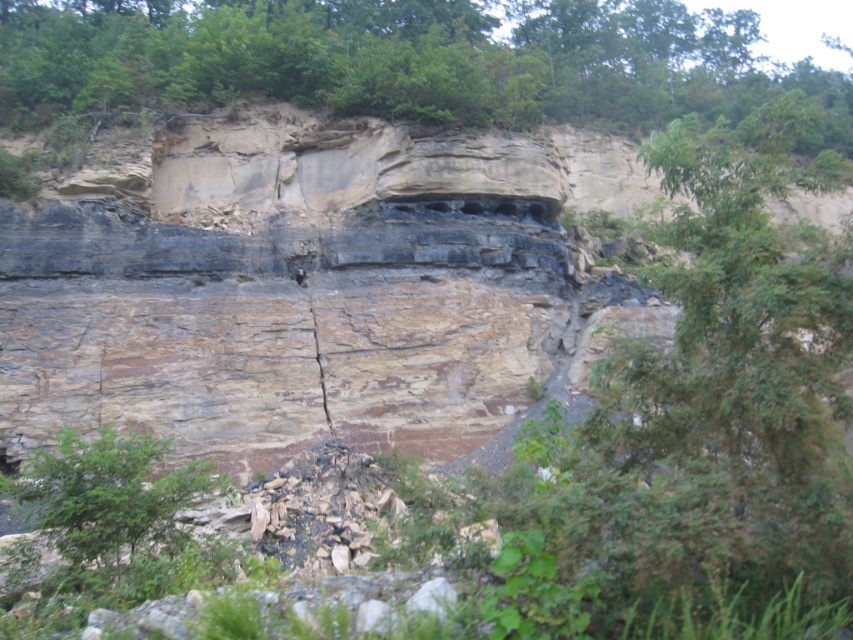
Based on the photo, you are a hiker standing at the base of the cliff and see the green leafy tree at upper center and the green leafy tree at lower left. Which tree is higher up on the cliff?

The green leafy tree at upper center is higher up on the cliff than the green leafy tree at lower left.

Based on the photo, you are a hiker standing at the base of the cliff. You notice two points marked on the cliff face. The first point is at coordinates point (322, 33) and the second is at point (82, 497). Which point is closer to your current position?

Point (82, 497) is closer to your current position because it is in front of point (322, 33).